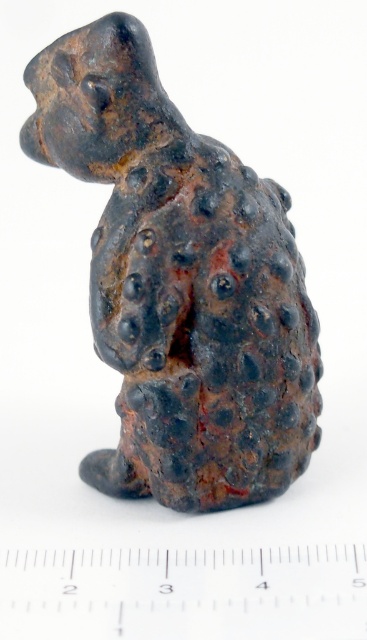
You are a sculptor who wants to create a miniature version of the rusty metal dog at center. You have a white plastic ruler at center as a reference. Can you determine if the width of the dog is narrower than the ruler?

The rusty metal dog at center is thinner than white plastic ruler at center, so yes, the width of the dog is narrower than the ruler.